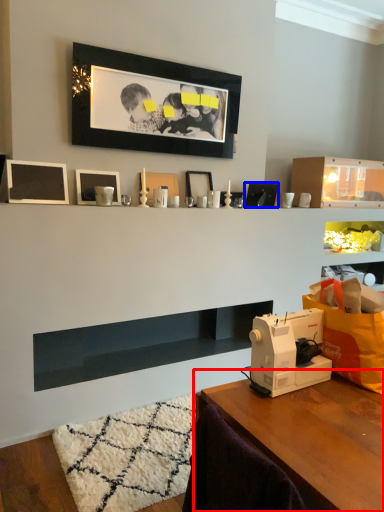
Question: Which point is closer to the camera, table (highlighted by a red box) or picture frame (highlighted by a blue box)?

Choices:
 (A) table
 (B) picture frame

Answer: (A)